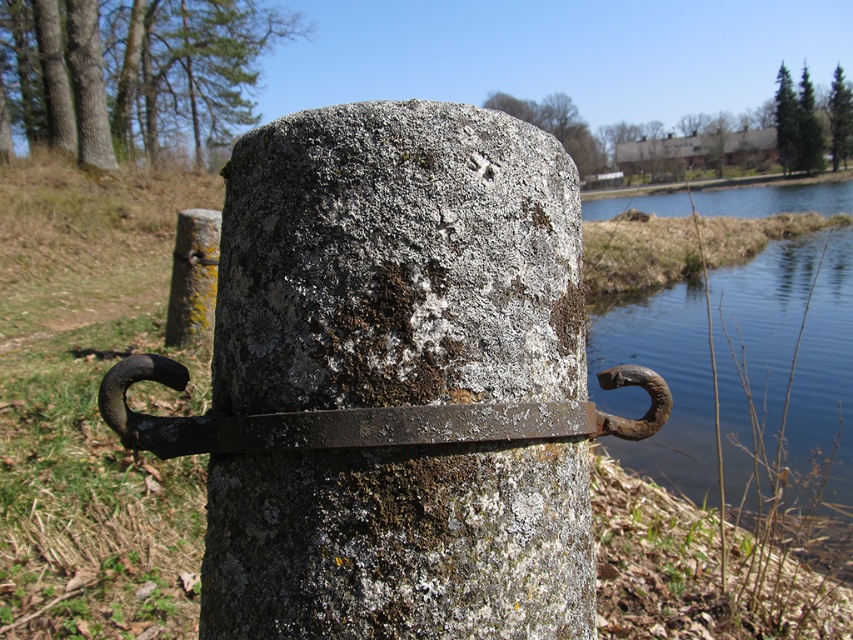
Question: Is rusty metal post at center positioned before blue water at right?

Choices:
 (A) yes
 (B) no

Answer: (A)

Question: Which of the following is the closest to the observer?

Choices:
 (A) (711, 289)
 (B) (279, 588)
 (C) (173, 285)
 (D) (167, 422)

Answer: (B)

Question: Which point appears closest to the camera in this image?

Choices:
 (A) click(204, 305)
 (B) click(521, 416)

Answer: (B)

Question: Can you confirm if rusty metal post at center is positioned to the left of rusty metal hook at center?

Choices:
 (A) yes
 (B) no

Answer: (A)

Question: Among these objects, which one is nearest to the camera?

Choices:
 (A) rusty metal post at center
 (B) blue water at right
 (C) green mossy stone at center
 (D) rusty metal hook at center

Answer: (D)

Question: Can you confirm if rusty metal hook at center is bigger than green mossy stone at center?

Choices:
 (A) yes
 (B) no

Answer: (B)